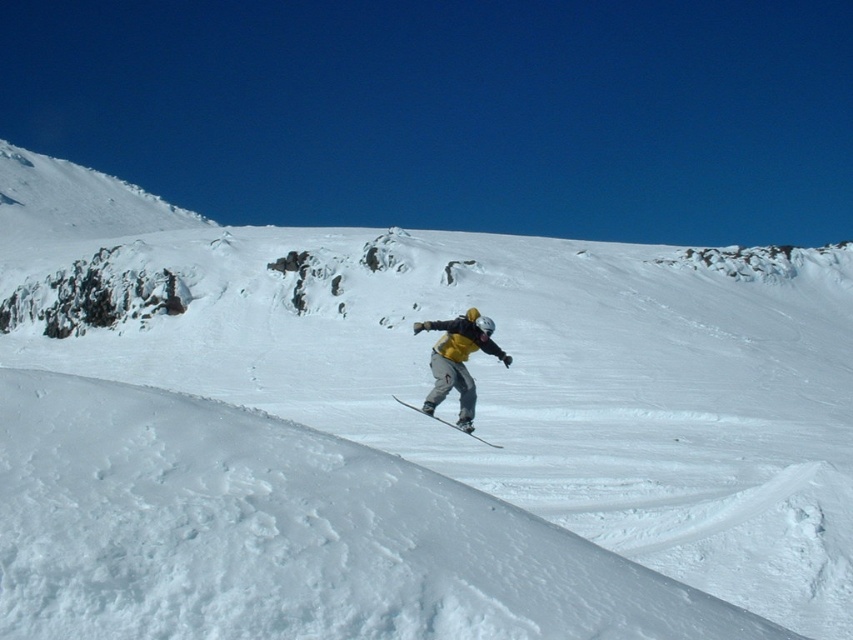
You are a photographer positioned at the top of the slope. You want to capture a photo of both the yellow fabric snowboarder at center and the metallic gray ski at center in the same frame. Based on their positions, which object should you adjust your camera to focus on first to ensure both are in the shot?

The yellow fabric snowboarder at center is to the right of the metallic gray ski at center. To ensure both are in the shot, focus on the metallic gray ski at center first since it is on the left, allowing the camera to capture the entire area from left to right, including the snowboarder to its right.

You are a drone operator trying to capture the snowboarder in the image. The snowboarder is represented by the point at (457,364). To ensure the snowboarder stays in frame, you need to adjust the camera angle so that the point remains within the central 20x20 pixel area of the image. Given that the image has a resolution of 1000x1000 pixels, is the current position of the snowboarder within this central area?

The snowboarder represented by point at (457,364) is located at the center of the image. Since the central 20x20 pixel area is centered at the image center, the snowboarder is within this area.